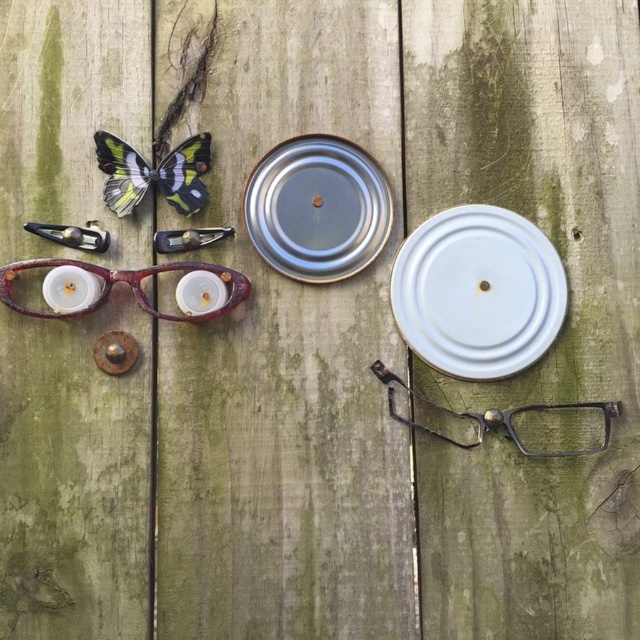
In the scene shown: Can you confirm if metallic wire frame glasses at lower right is positioned above wooden textured glasses at left?

Actually, metallic wire frame glasses at lower right is below wooden textured glasses at left.

The height and width of the screenshot is (640, 640). In order to click on metallic wire frame glasses at lower right in this screenshot , I will do `click(520, 420)`.

This screenshot has height=640, width=640. Describe the element at coordinates (477, 292) in the screenshot. I see `white matte plate at center` at that location.

Is point (536, 243) farther from viewer compared to point (307, 136)?

No, (536, 243) is closer to viewer.

This screenshot has width=640, height=640. Find the location of `white matte plate at center`. white matte plate at center is located at coordinates (477, 292).

Does white matte plate at center have a greater height compared to translucent plastic butterfly at upper left?

Correct, white matte plate at center is much taller as translucent plastic butterfly at upper left.

Is point (456, 262) closer to viewer compared to point (115, 209)?

No, it is not.

Locate an element on the screen. white matte plate at center is located at coordinates (477, 292).